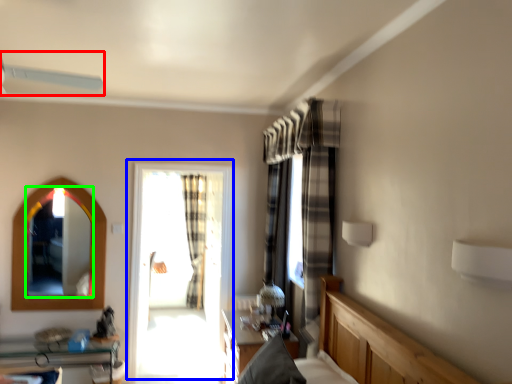
Question: Considering the real-world distances, which object is farthest from fan (highlighted by a red box)? window (highlighted by a blue box) or mirror (highlighted by a green box)?

Choices:
 (A) window
 (B) mirror

Answer: (A)